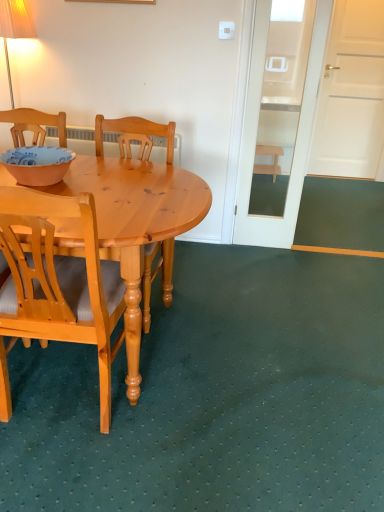
Question: Considering the relative positions of matte orange bowl at left and light brown wood chair at left, positioned as the 1th chair in front-to-back order, in the image provided, is matte orange bowl at left to the right of light brown wood chair at left, positioned as the 1th chair in front-to-back order, from the viewer's perspective?

Choices:
 (A) no
 (B) yes

Answer: (A)

Question: Is matte orange bowl at left positioned with its back to light brown wood chair at left, which is counted as the second chair, starting from the back?

Choices:
 (A) no
 (B) yes

Answer: (A)

Question: Is matte orange bowl at left taller than light brown wood chair at left, positioned as the 1th chair in front-to-back order?

Choices:
 (A) yes
 (B) no

Answer: (B)

Question: Does matte orange bowl at left appear on the left side of light brown wood chair at left, which is counted as the second chair, starting from the back?

Choices:
 (A) no
 (B) yes

Answer: (B)

Question: From the image's perspective, is matte orange bowl at left located above light brown wood chair at left, positioned as the 1th chair in front-to-back order?

Choices:
 (A) no
 (B) yes

Answer: (B)

Question: Would you say matte orange bowl at left contains light brown wood chair at left, positioned as the 1th chair in front-to-back order?

Choices:
 (A) no
 (B) yes

Answer: (A)

Question: From the image's perspective, is wooden stool at right located above light wood chair at center, which ranks as the first chair in back-to-front order?

Choices:
 (A) no
 (B) yes

Answer: (B)

Question: Considering the relative sizes of wooden stool at right and light wood chair at center, which is the second chair from front to back, in the image provided, is wooden stool at right shorter than light wood chair at center, which is the second chair from front to back,?

Choices:
 (A) no
 (B) yes

Answer: (B)

Question: Is wooden stool at right thinner than light wood chair at center, which is the second chair from front to back?

Choices:
 (A) no
 (B) yes

Answer: (B)

Question: Does wooden stool at right come behind light wood chair at center, which ranks as the first chair in back-to-front order?

Choices:
 (A) no
 (B) yes

Answer: (B)

Question: Is wooden stool at right in front of light wood chair at center, which is the second chair from front to back?

Choices:
 (A) yes
 (B) no

Answer: (B)

Question: Could you tell me if wooden stool at right is facing light wood chair at center, which is the second chair from front to back?

Choices:
 (A) no
 (B) yes

Answer: (B)

Question: Considering the relative positions of light brown wood chair at left, which is counted as the second chair, starting from the back, and matte orange bowl at left in the image provided, is light brown wood chair at left, which is counted as the second chair, starting from the back, to the left of matte orange bowl at left from the viewer's perspective?

Choices:
 (A) no
 (B) yes

Answer: (A)